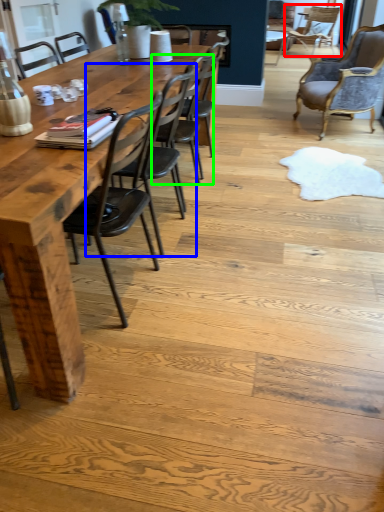
Question: Which is nearer to the chair (highlighted by a red box)? chair (highlighted by a blue box) or chair (highlighted by a green box).

Choices:
 (A) chair
 (B) chair

Answer: (B)